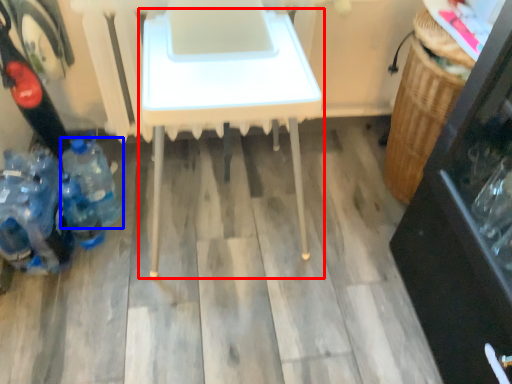
Question: Which object is closer to the camera taking this photo, table (highlighted by a red box) or bottle (highlighted by a blue box)?

Choices:
 (A) table
 (B) bottle

Answer: (A)